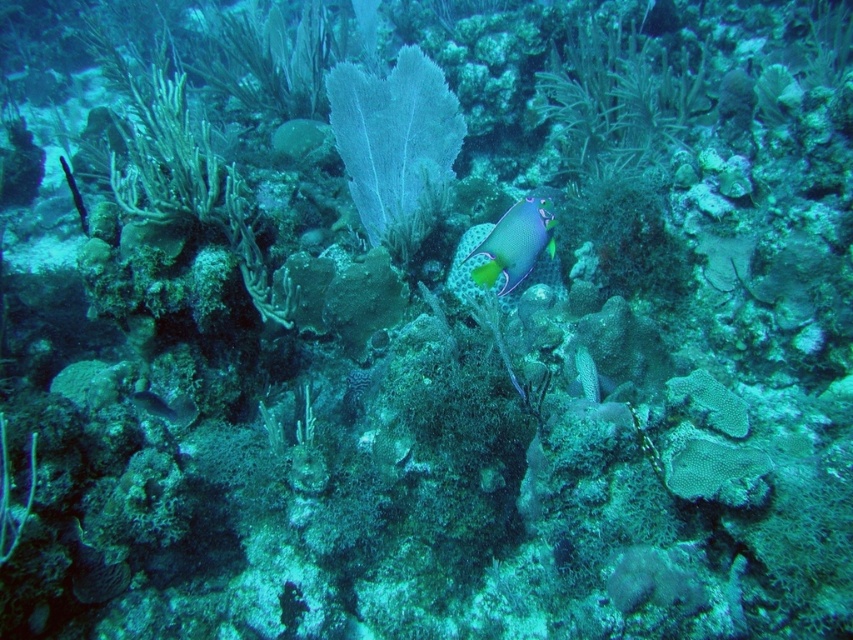
You are a marine biologist studying coral reefs. You observe two corals in the image, the translucent white coral at center and the multicolored coral at center. Which of these corals is taller?

The translucent white coral at center is much taller than the multicolored coral at center, so the translucent white coral at center is taller.

You are a scuba diver swimming in the coral reef and want to take a photo of the shiny silver fish at lower left. Since the multicolored coral at center is blocking your view, can you move around it to get a clear shot?

The multicolored coral at center is closer to the viewer than the shiny silver fish at lower left, so you can move around the coral to get a clear view of the fish.

You are a marine biologist studying the coral reef. You notice a multicolored coral at center and another coral formation. How far apart are these two coral formations?

The multicolored coral at center and the other coral formation are 2.06 meters apart.